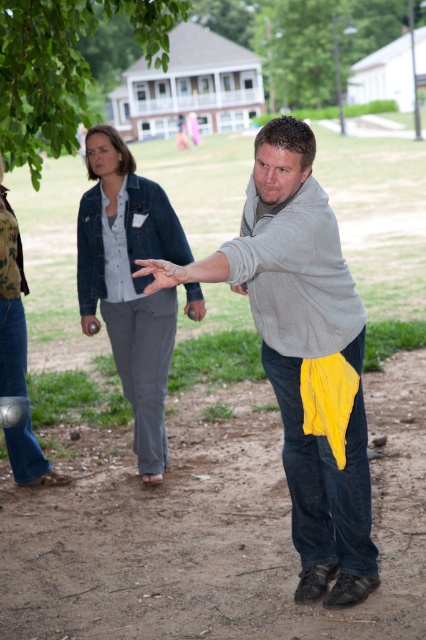
In the scene where a man is throwing a ball and a woman is watching, which clothing item is positioned to the right of the other between the gray cotton sweater at center and the denim pants at center?

The gray cotton sweater at center is positioned to the right of the denim pants at center.

You are a photographer trying to capture a candid shot of the gray fleece sweatshirt at center without the denim jacket at upper left blocking the view. Is this possible given their positions?

The gray fleece sweatshirt at center is behind the denim jacket at upper left, so it would be blocked from view. You cannot capture a clear shot of the gray fleece sweatshirt at center without the denim jacket at upper left blocking it.

You are a fashion designer analyzing the clothing items in the scene. Which clothing item, the gray cotton sweater at center or the denim pants at center, has a greater width?

Answer: The gray cotton sweater at center has a greater width than the denim pants at center.